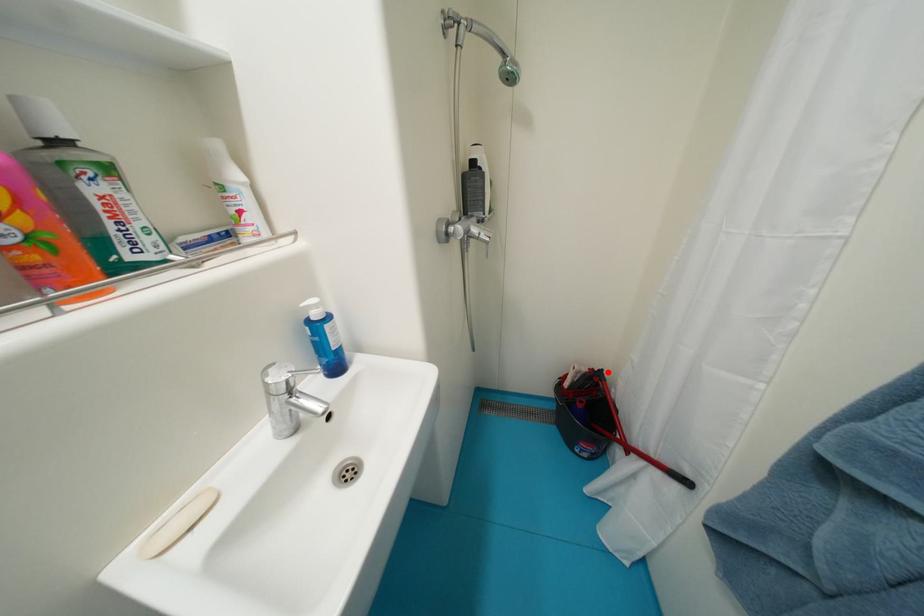
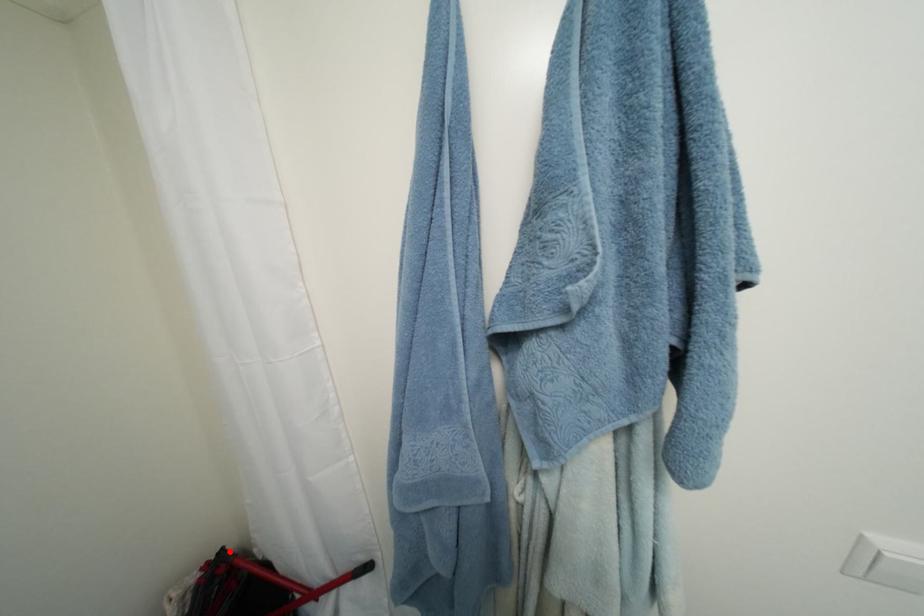
In the scene shown: I am providing you with two images of the same scene from different viewpoints. A red point is marked on the first image and another point is marked on the second image. Is the red point in image1 aligned with the point shown in image2?

Yes